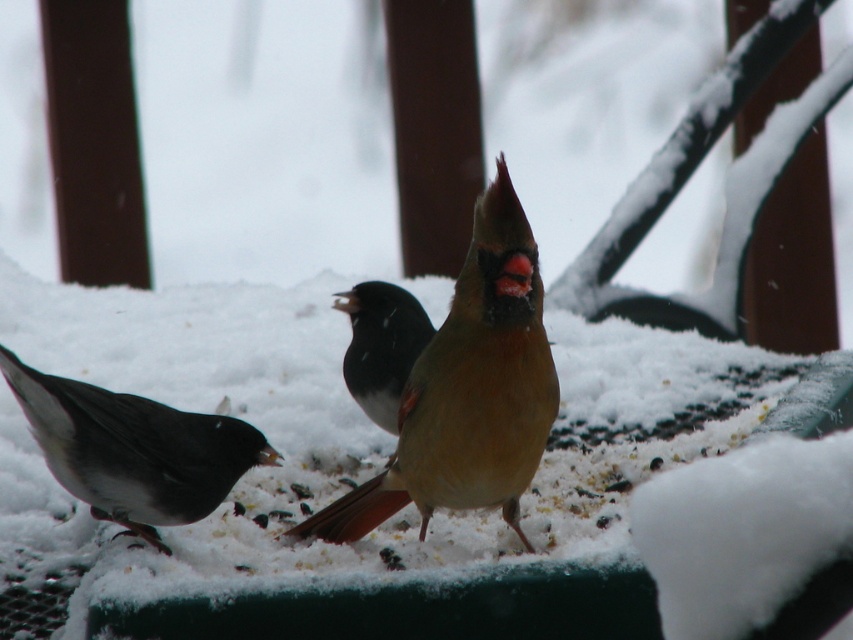
The width and height of the screenshot is (853, 640). I want to click on dark gray matte sparrow at lower left, so click(132, 451).

Can you confirm if dark gray matte sparrow at lower left is shorter than shiny black bird at center?

Yes.

Between point (128, 528) and point (416, 312), which one is positioned behind?

Positioned behind is point (416, 312).

At what (x,y) coordinates should I click in order to perform the action: click on dark gray matte sparrow at lower left. Please return your answer as a coordinate pair (x, y). Looking at the image, I should click on (132, 451).

Does matte yellow bird at center have a greater height compared to shiny black bird at center?

Yes, matte yellow bird at center is taller than shiny black bird at center.

This screenshot has width=853, height=640. What do you see at coordinates (468, 390) in the screenshot?
I see `matte yellow bird at center` at bounding box center [468, 390].

Where is `matte yellow bird at center`? matte yellow bird at center is located at coordinates (468, 390).

Does matte yellow bird at center have a larger size compared to dark gray matte sparrow at lower left?

Yes, matte yellow bird at center is bigger than dark gray matte sparrow at lower left.

Is point (425, 369) behind point (163, 422)?

No, it is in front of (163, 422).

Does point (474, 205) lie behind point (38, 428)?

No, (474, 205) is closer to viewer.

Where is `matte yellow bird at center`? The height and width of the screenshot is (640, 853). matte yellow bird at center is located at coordinates (468, 390).